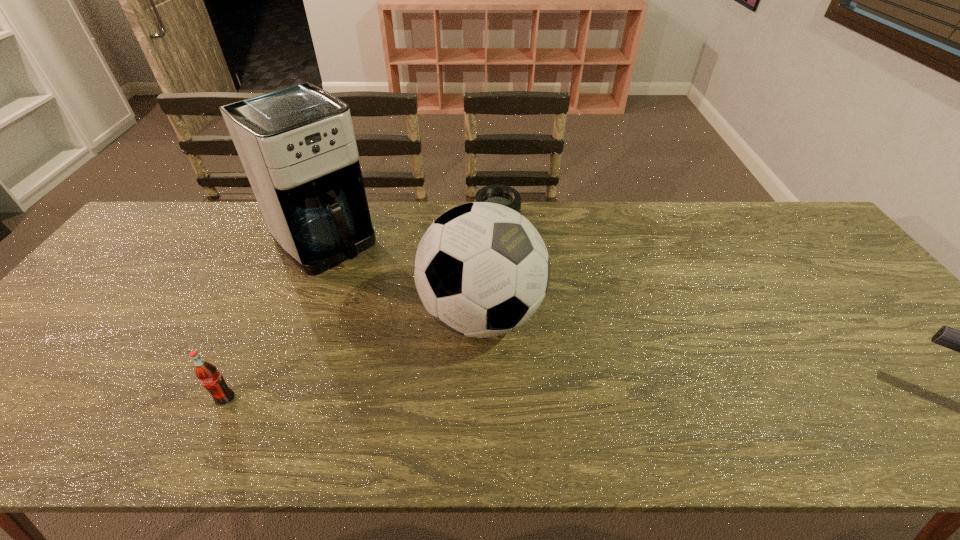
At what (x,y) coordinates should I click in order to perform the action: click on free space located on the front panel of the tallest object. Please return your answer as a coordinate pair (x, y). The image size is (960, 540). Looking at the image, I should click on (365, 276).

Identify the location of free spot located on the front panel of the tallest object. The height and width of the screenshot is (540, 960). (424, 329).

Where is `vacant area situated on the front panel of the tallest object`? The height and width of the screenshot is (540, 960). vacant area situated on the front panel of the tallest object is located at coordinates (437, 341).

Where is `telephoto lens at the far edge`? The image size is (960, 540). telephoto lens at the far edge is located at coordinates (504, 195).

What are the coordinates of `coffee maker situated at the far edge` in the screenshot? It's located at (297, 145).

Image resolution: width=960 pixels, height=540 pixels. I want to click on object located in the near edge section of the desktop, so click(x=207, y=373).

The height and width of the screenshot is (540, 960). I want to click on vacant space at the far edge of the desktop, so click(x=611, y=210).

This screenshot has width=960, height=540. I want to click on blank area at the near edge, so click(523, 376).

Locate an element on the screen. The width and height of the screenshot is (960, 540). vacant space at the left edge of the desktop is located at coordinates (159, 267).

You are a GUI agent. You are given a task and a screenshot of the screen. Output one action in this format:
    pyautogui.click(x=<x>, y=<y>)
    Task: Click on the vacant space at the right edge of the desktop
    
    Given the screenshot: What is the action you would take?
    click(897, 325)